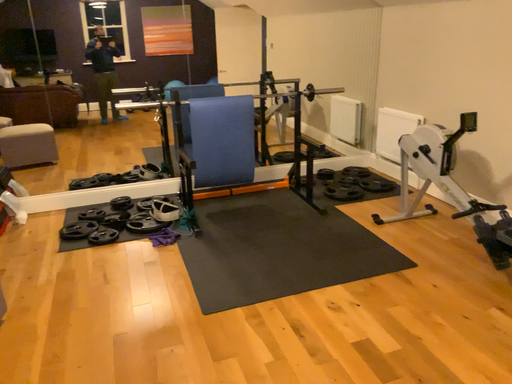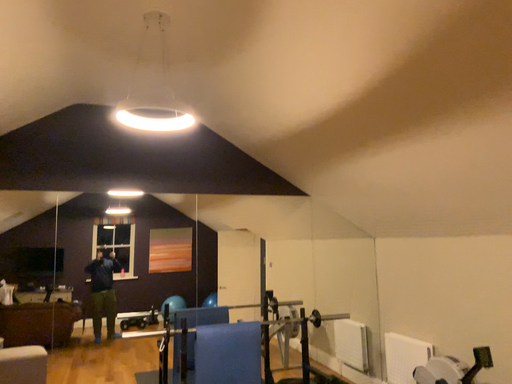
Question: Which way did the camera rotate in the video?

Choices:
 (A) rotated upward
 (B) rotated downward

Answer: (A)